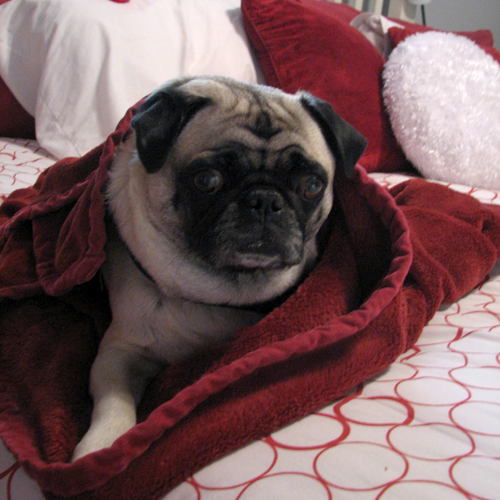
I want to click on wall, so tap(452, 13).